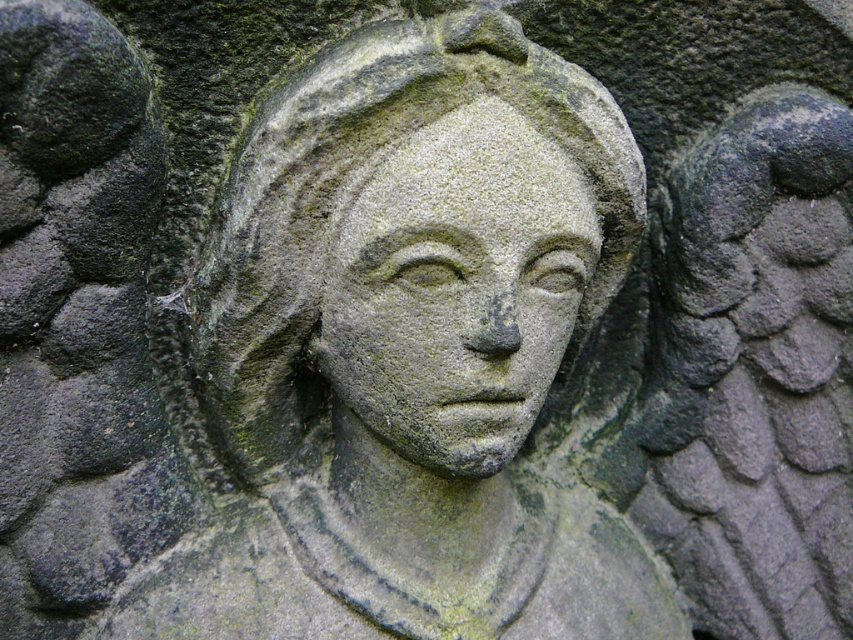
Which is behind, point (355, 429) or point (408, 256)?

The point (355, 429) is more distant.

Is green stone carving at center wider than green stone face at center?

Correct, the width of green stone carving at center exceeds that of green stone face at center.

This screenshot has height=640, width=853. I want to click on green stone carving at center, so click(x=409, y=352).